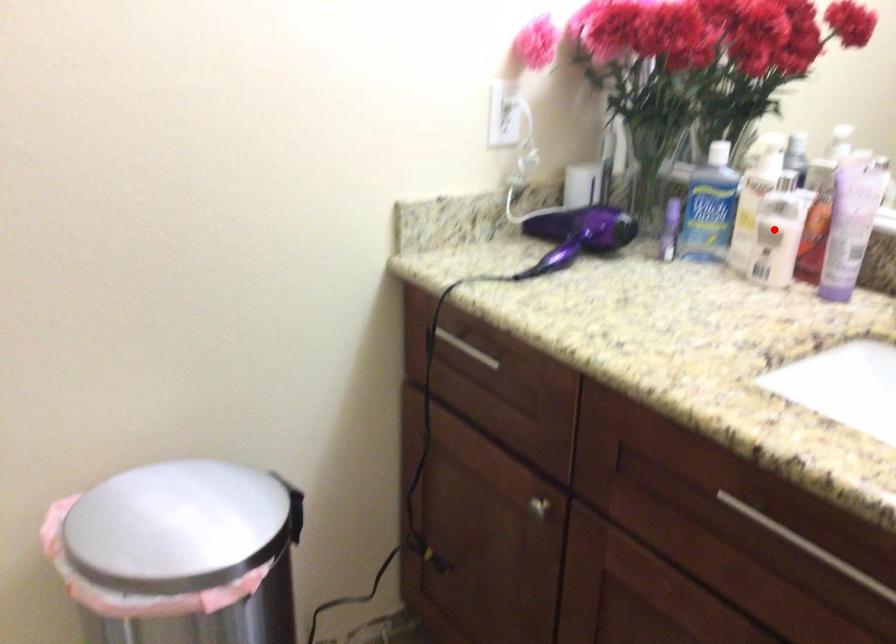
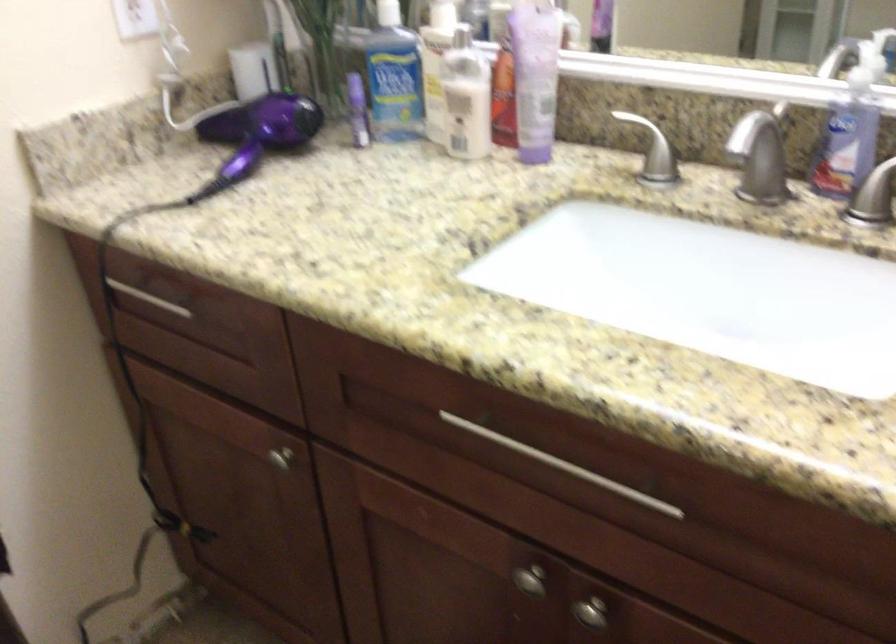
Question: I am providing you with two images of the same scene from different viewpoints. A red point is marked on the first image. Is the red point's position out of view in image 2?

Choices:
 (A) Yes
 (B) No

Answer: (B)